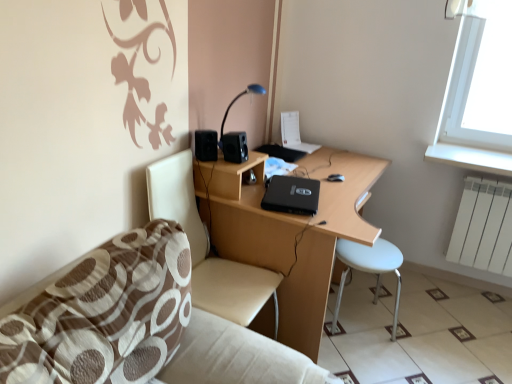
Question: From a real-world perspective, is black plastic speaker at upper center, the 2th speaker positioned from the left, physically located above or below black matte speaker at upper left, arranged as the first speaker when viewed from the left?

Choices:
 (A) below
 (B) above

Answer: (B)

Question: In terms of height, does black plastic speaker at upper center, the 2th speaker positioned from the left, look taller or shorter compared to black matte speaker at upper left, arranged as the first speaker when viewed from the left?

Choices:
 (A) tall
 (B) short

Answer: (B)

Question: Which of these objects is positioned farthest from the black matte desk at center?

Choices:
 (A) black matte speaker at upper left, the second speaker positioned from the right
 (B) blue glossy table lamp at upper center
 (C) beige fabric chair at left
 (D) white glossy tile at lower right
 (E) black matte laptop at center

Answer: (D)

Question: Based on their relative distances, which object is farther from the black plastic speaker at upper center, the 2th speaker positioned from the left?

Choices:
 (A) white plastic stool at lower right
 (B) brown fabric couch at lower left
 (C) black matte speaker at upper left, the second speaker positioned from the right
 (D) white glossy tile at lower right
 (E) black matte desk at center

Answer: (D)